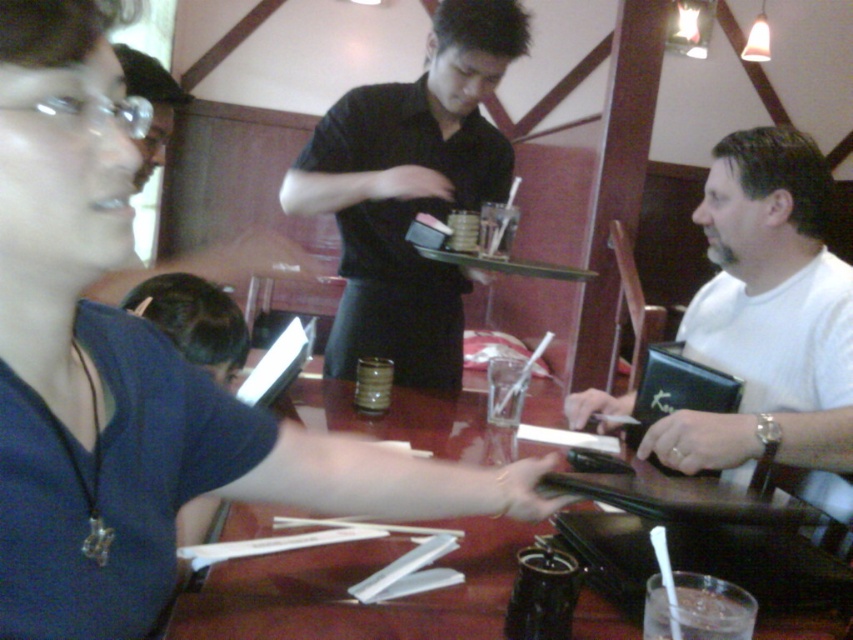
Is matte blue shirt at center further to camera compared to wooden table at center?

No, it is not.

Which of these two, matte blue shirt at center or wooden table at center, stands shorter?

With less height is wooden table at center.

Is point (306, 442) less distant than point (292, 602)?

Yes.

This screenshot has height=640, width=853. I want to click on matte blue shirt at center, so click(135, 374).

Does matte blue shirt at center have a greater height compared to clear glass at table center?

Correct, matte blue shirt at center is much taller as clear glass at table center.

Who is more distant from viewer, (74, 328) or (691, 593)?

The point (691, 593) is more distant.

Locate an element on the screen. The height and width of the screenshot is (640, 853). matte blue shirt at center is located at coordinates (135, 374).

Does point (350, 188) lie behind point (331, 394)?

No, (350, 188) is closer to viewer.

Between point (436, 381) and point (309, 573), which one is positioned behind?

The point (436, 381) is more distant.

Where is `black shirt at center`? black shirt at center is located at coordinates (410, 193).